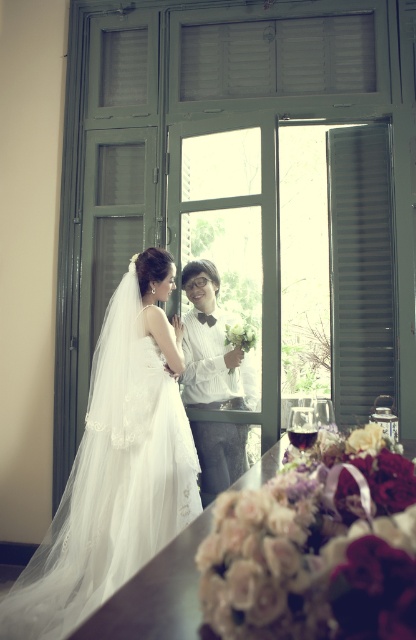
Question: Is white lace dress at center smaller than black matte shutter at right?

Choices:
 (A) no
 (B) yes

Answer: (A)

Question: Which point is closer to the camera taking this photo?

Choices:
 (A) (364, 157)
 (B) (183, 400)
 (C) (163, 516)

Answer: (C)

Question: Which of the following is the farthest from the observer?

Choices:
 (A) (192, 481)
 (B) (210, 346)

Answer: (B)

Question: Does white lace dress at center have a smaller size compared to black matte shutter at right?

Choices:
 (A) no
 (B) yes

Answer: (A)

Question: Which object is positioned farthest from the white textured shirt at center?

Choices:
 (A) black matte shutter at right
 (B) white lace dress at center

Answer: (B)

Question: Is black matte shutter at right smaller than white textured shirt at center?

Choices:
 (A) no
 (B) yes

Answer: (B)